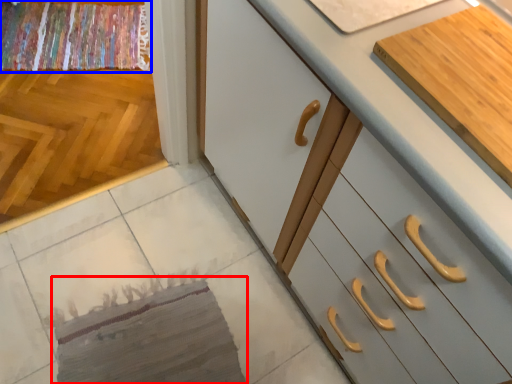
Question: Which object appears farthest to the camera in this image, mat (highlighted by a red box) or blanket (highlighted by a blue box)?

Choices:
 (A) mat
 (B) blanket

Answer: (B)